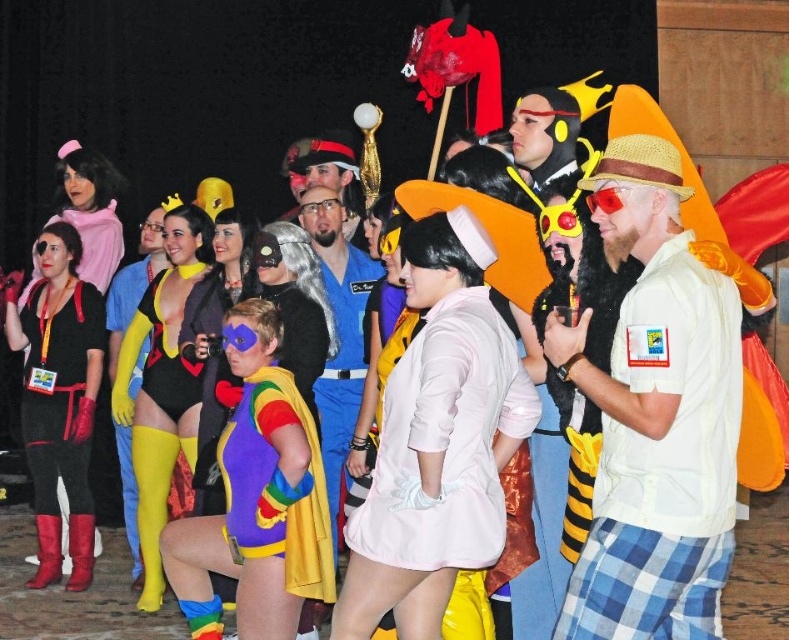
Question: Estimate the real-world distances between objects in this image. Which object is farther from the rainbow fabric superhero suit at center?

Choices:
 (A) pink satin dress at center
 (B) blue fabric shirt at center

Answer: (B)

Question: Does yellow spandex suit at center come in front of black spandex bodysuit at center?

Choices:
 (A) no
 (B) yes

Answer: (A)

Question: Does beige cotton shirt at center appear over matte blue shirt at center?

Choices:
 (A) no
 (B) yes

Answer: (A)

Question: Can you confirm if rainbow fabric superhero suit at center is positioned to the left of yellow spandex suit at center?

Choices:
 (A) no
 (B) yes

Answer: (A)

Question: Which point appears farthest from the camera in this image?

Choices:
 (A) (122, 426)
 (B) (356, 257)
 (C) (690, 483)

Answer: (B)

Question: Estimate the real-world distances between objects in this image. Which object is closer to the black spandex bodysuit at center?

Choices:
 (A) matte black costume at left
 (B) matte blue shirt at center

Answer: (A)